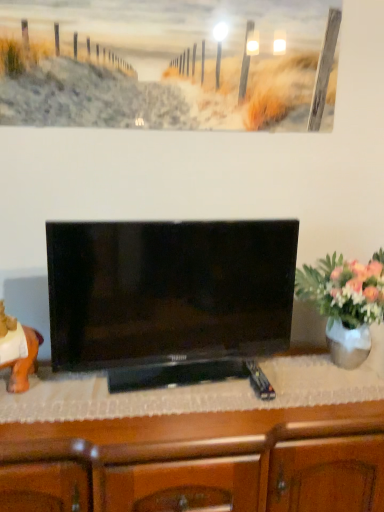
Question: Can you confirm if orange matte statue at left is shorter than black glossy tv at center?

Choices:
 (A) yes
 (B) no

Answer: (A)

Question: Does orange matte statue at left appear on the right side of black glossy tv at center?

Choices:
 (A) yes
 (B) no

Answer: (B)

Question: From the image's perspective, does orange matte statue at left appear lower than black glossy tv at center?

Choices:
 (A) no
 (B) yes

Answer: (B)

Question: Is orange matte statue at left positioned before black glossy tv at center?

Choices:
 (A) no
 (B) yes

Answer: (A)

Question: Would you say orange matte statue at left contains black glossy tv at center?

Choices:
 (A) no
 (B) yes

Answer: (A)

Question: Relative to orange matte statue at left, is black glossy tv at center in front or behind?

Choices:
 (A) behind
 (B) front

Answer: (B)

Question: From the image's perspective, is black glossy tv at center positioned above or below orange matte statue at left?

Choices:
 (A) above
 (B) below

Answer: (A)

Question: Is black glossy tv at center situated inside orange matte statue at left or outside?

Choices:
 (A) inside
 (B) outside

Answer: (B)

Question: Based on their positions, is black glossy tv at center located to the left or right of orange matte statue at left?

Choices:
 (A) left
 (B) right

Answer: (B)

Question: From the image's perspective, is wooden cabinet at center positioned above or below black glossy tv at center?

Choices:
 (A) below
 (B) above

Answer: (A)

Question: From a real-world perspective, relative to black glossy tv at center, is wooden cabinet at center vertically above or below?

Choices:
 (A) above
 (B) below

Answer: (B)

Question: Is point (301, 415) positioned closer to the camera than point (213, 296)?

Choices:
 (A) closer
 (B) farther

Answer: (A)

Question: Do you think wooden cabinet at center is within black glossy tv at center, or outside of it?

Choices:
 (A) inside
 (B) outside

Answer: (B)

Question: Considering the positions of point (286, 442) and point (29, 328), is point (286, 442) closer or farther from the camera than point (29, 328)?

Choices:
 (A) farther
 (B) closer

Answer: (B)

Question: Considering the positions of wooden cabinet at center and orange matte statue at left in the image, is wooden cabinet at center taller or shorter than orange matte statue at left?

Choices:
 (A) tall
 (B) short

Answer: (A)